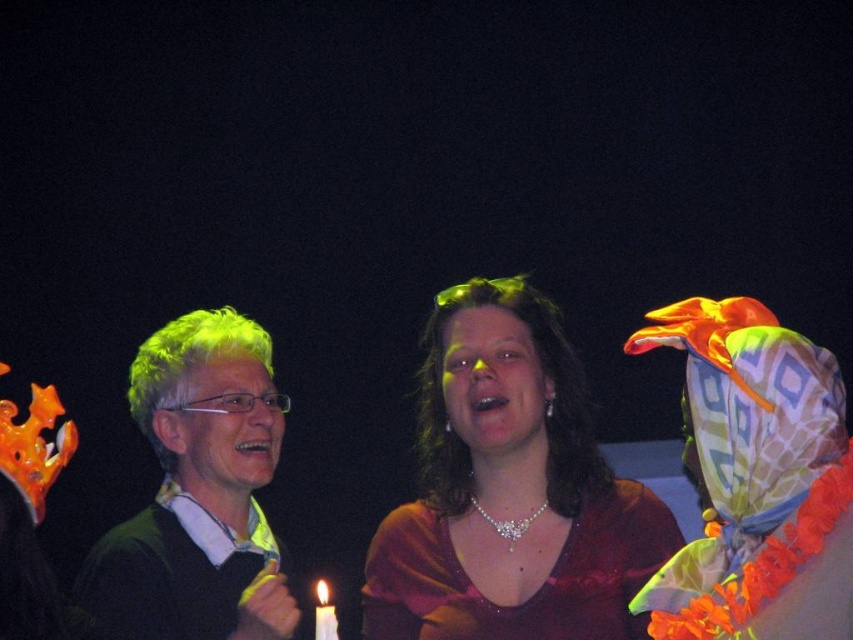
Question: Does smooth skin face at center appear on the right side of matte black face at center?

Choices:
 (A) no
 (B) yes

Answer: (B)

Question: Does satin burgundy dress at center have a lesser width compared to green matte sweater at left?

Choices:
 (A) no
 (B) yes

Answer: (A)

Question: Among these points, which one is farthest from the camera?

Choices:
 (A) (276, 440)
 (B) (612, 522)
 (C) (265, 388)

Answer: (C)

Question: Considering the real-world distances, which object is farthest from the satin burgundy dress at center?

Choices:
 (A) white wax candle at lower center
 (B) smooth skin face at center
 (C) green matte sweater at left
 (D) matte black face at center

Answer: (A)

Question: Which point appears farthest from the camera in this image?

Choices:
 (A) (241, 376)
 (B) (511, 448)
 (C) (500, 502)
 (D) (317, 614)

Answer: (A)

Question: Considering the relative positions of green matte sweater at left and matte black face at center in the image provided, where is green matte sweater at left located with respect to matte black face at center?

Choices:
 (A) right
 (B) left

Answer: (B)